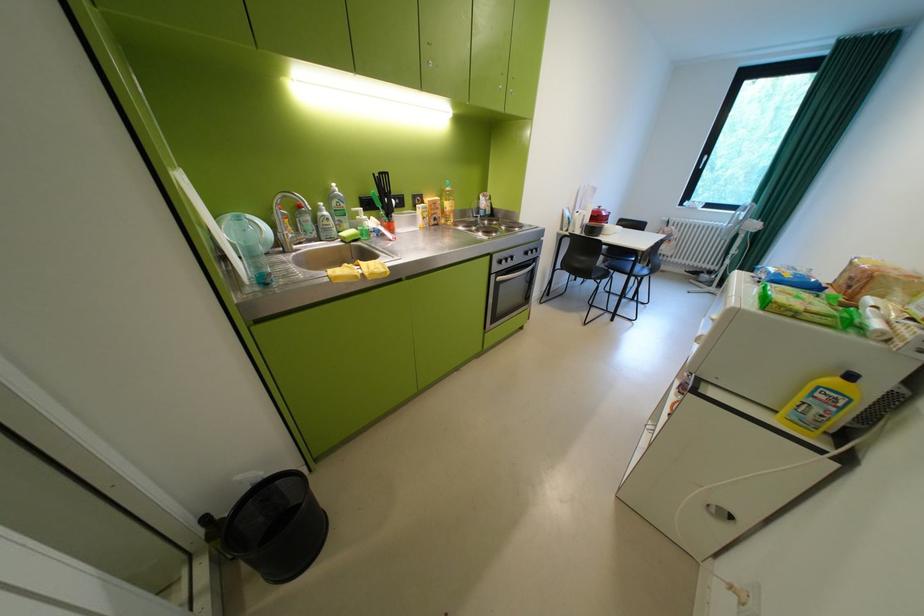
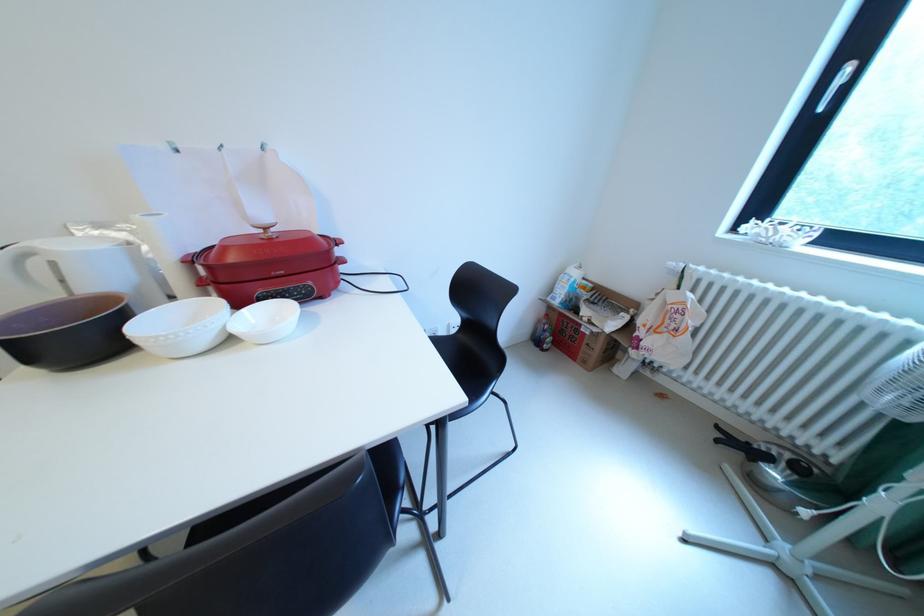
Where in the second image is the point corresponding to the point at 676,230 from the first image?

(682, 297)